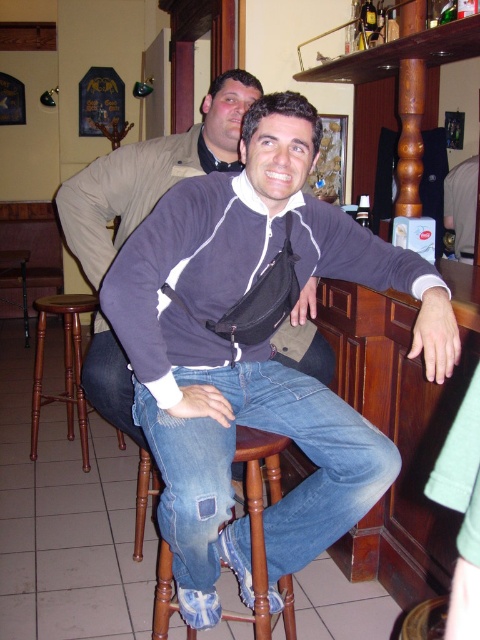
Question: Can you confirm if wooden bar stool at lower center is bigger than gray fabric shirt at upper right?

Choices:
 (A) no
 (B) yes

Answer: (B)

Question: Is dark blue fleece at center smaller than brown wooden stool at lower left?

Choices:
 (A) yes
 (B) no

Answer: (B)

Question: Does dark blue fleece at center have a smaller size compared to gray fabric shirt at upper right?

Choices:
 (A) no
 (B) yes

Answer: (A)

Question: Among these points, which one is nearest to the camera?

Choices:
 (A) (159, 381)
 (B) (470, 241)
 (C) (218, 483)
 (D) (259, 564)

Answer: (C)

Question: Which of the following is the farthest from the observer?

Choices:
 (A) blue denim jeans at center
 (B) wooden bar stool at lower center

Answer: (B)

Question: Which of the following is the closest to the observer?

Choices:
 (A) (456, 164)
 (B) (36, 406)

Answer: (B)